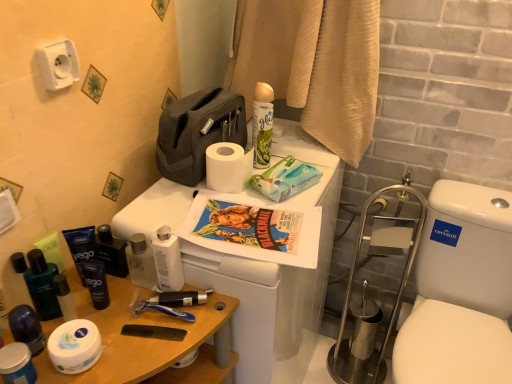
You are a GUI agent. You are given a task and a screenshot of the screen. Output one action in this format:
    pyautogui.click(x=<x>, y=<y>)
    Task: Click on the vacant area that is situated to the right of matte black shaving cream at left, positioned as the sixth toiletry in right-to-left order
    The image size is (512, 384).
    Given the screenshot: What is the action you would take?
    pyautogui.click(x=134, y=335)